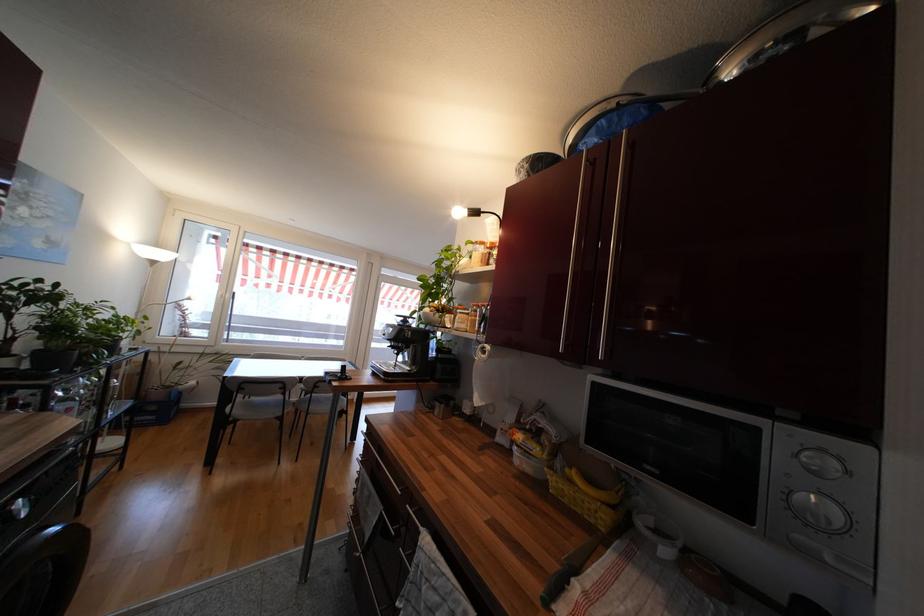
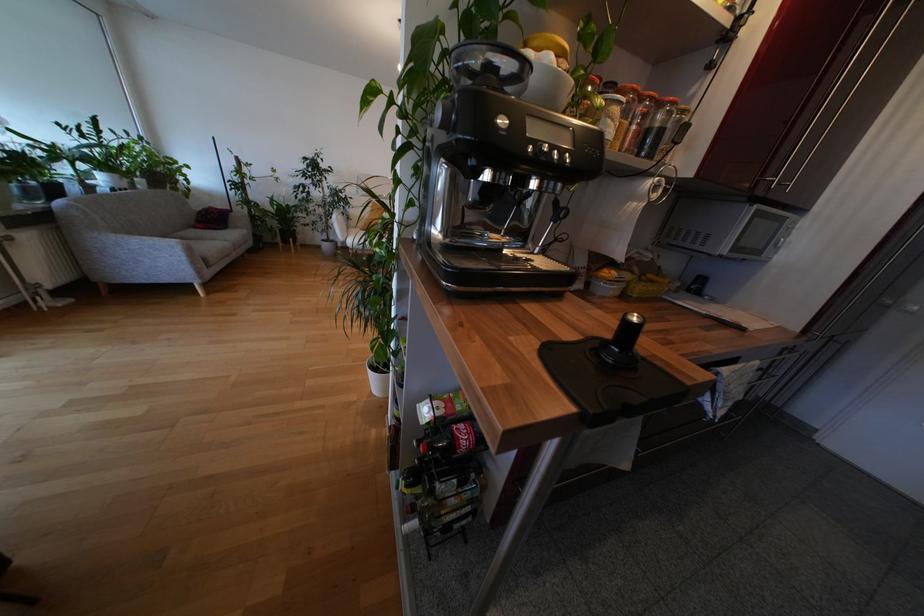
Find the pixel in the second image that matches pixel 478 307 in the first image.

(636, 92)